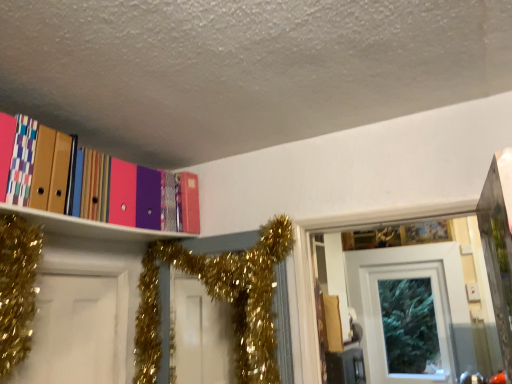
Question: Is point (416, 256) positioned closer to the camera than point (158, 233)?

Choices:
 (A) farther
 (B) closer

Answer: (A)

Question: In the image, is white glossy door at upper center on the left side or the right side of matte plastic folders at upper left?

Choices:
 (A) left
 (B) right

Answer: (B)

Question: Based on their relative distances, which object is farther from the gold glitter garland at upper center?

Choices:
 (A) white glossy door at upper center
 (B) matte plastic folders at upper left

Answer: (A)

Question: Estimate the real-world distances between objects in this image. Which object is farther from the white glossy door at upper center?

Choices:
 (A) matte plastic folders at upper left
 (B) gold glitter garland at upper center

Answer: (A)